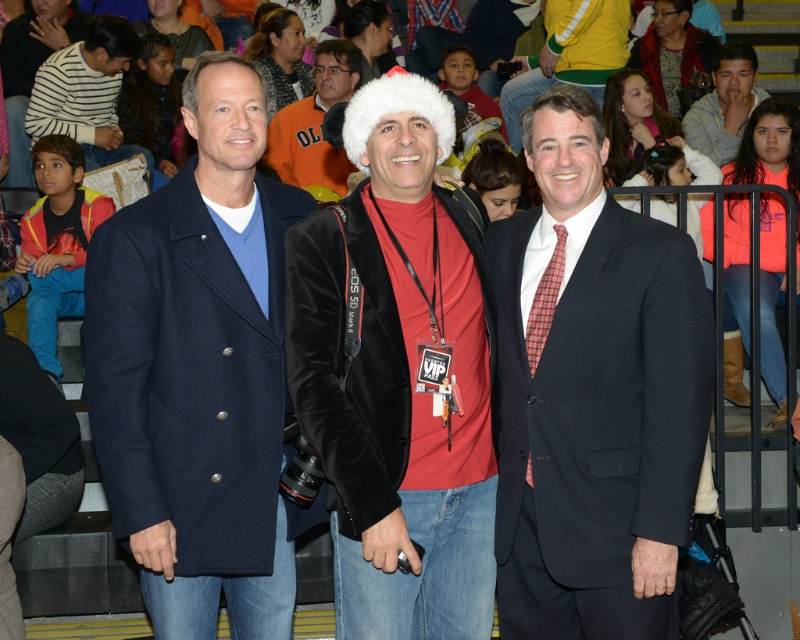
Is navy wool coat at center below velvet black jacket at center?

Incorrect, navy wool coat at center is not positioned below velvet black jacket at center.

Is navy wool coat at center to the left of velvet black jacket at center from the viewer's perspective?

Yes, navy wool coat at center is to the left of velvet black jacket at center.

Does point (286, 512) come farther from viewer compared to point (380, 250)?

That is True.

Find the location of `navy wool coat at center`. navy wool coat at center is located at coordinates (200, 371).

Who is taller, navy wool coat at center or velvet jacket at center?

navy wool coat at center

Can you confirm if navy wool coat at center is thinner than velvet jacket at center?

Indeed, navy wool coat at center has a lesser width compared to velvet jacket at center.

This screenshot has height=640, width=800. What are the coordinates of `navy wool coat at center` in the screenshot? It's located at (200, 371).

Consider the image. Between striped sweater at left and velvet jacket at center, which one is positioned lower?

velvet jacket at center

Where is `striped sweater at left`? The width and height of the screenshot is (800, 640). striped sweater at left is located at coordinates (86, 92).

Is point (80, 74) more distant than point (737, 54)?

That is False.

The height and width of the screenshot is (640, 800). In order to click on striped sweater at left in this screenshot , I will do `click(86, 92)`.